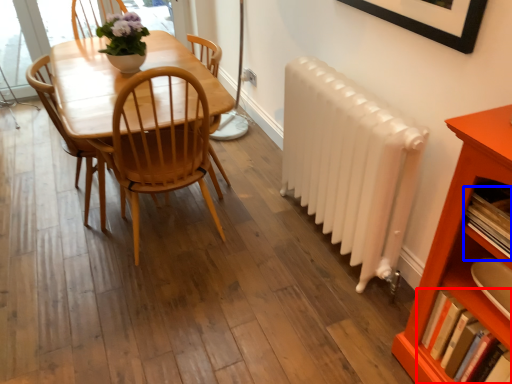
Question: Which of the following is the closest to the observer, book (highlighted by a red box) or book (highlighted by a blue box)?

Choices:
 (A) book
 (B) book

Answer: (B)